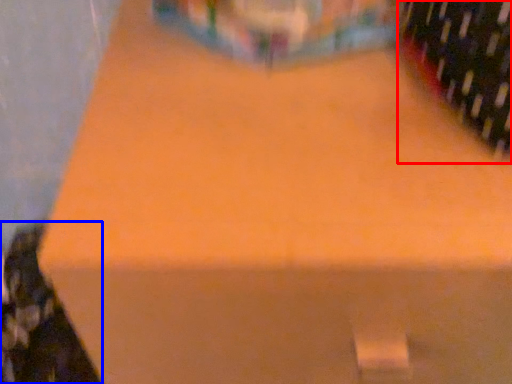
Question: Which object is closer to the camera taking this photo, wine bottle (highlighted by a red box) or wine bottle (highlighted by a blue box)?

Choices:
 (A) wine bottle
 (B) wine bottle

Answer: (A)